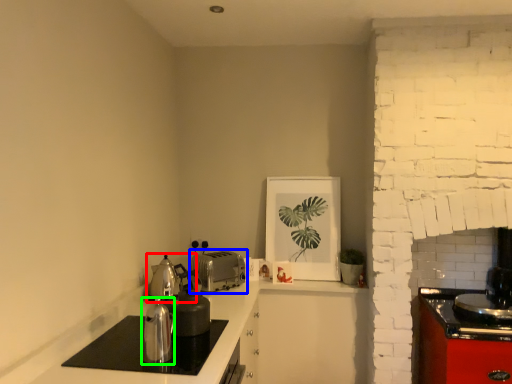
Question: Which is nearer to the tea pot (highlighted by a red box)? toaster (highlighted by a blue box) or kitchen appliance (highlighted by a green box).

Choices:
 (A) toaster
 (B) kitchen appliance

Answer: (A)